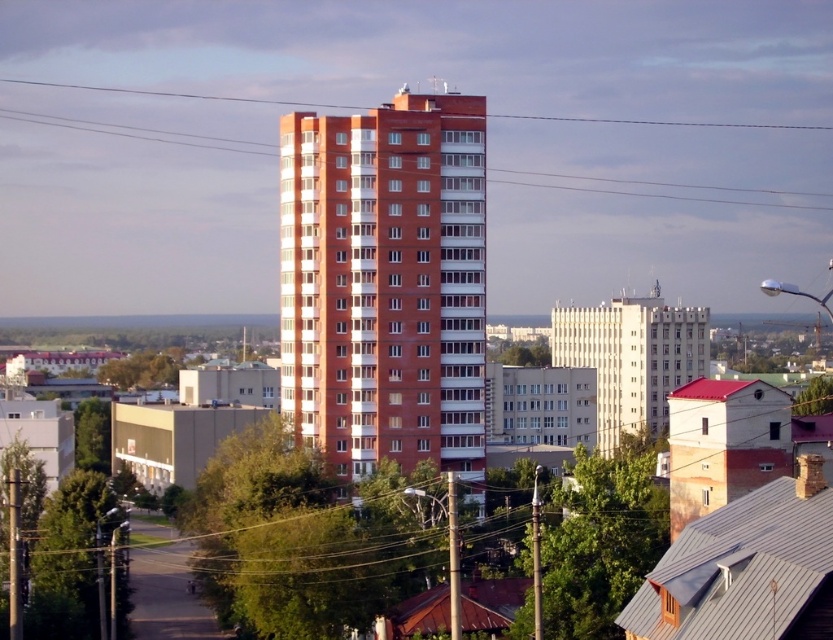
You are an architect analyzing the city layout. You observe the brick building at center and the white smooth building at center. Which building is located higher in the image?

The brick building at center is positioned over the white smooth building at center, so it is higher in the image.

From the picture: You are a city planner reviewing the city layout. You notice two buildings in the center of the image, the brick building at center and the white smooth building at center. Which one has a larger footprint in terms of area?

The brick building at center is bigger than the white smooth building at center, so the brick building at center has a larger footprint in terms of area.

You are standing at the base of the red brick high rise building and looking towards the city. There are two points marked in the image, point 1 at coordinates point [434,289] and point 2 at coordinates point [617,353]. Which point is closer to you?

Point [434,289] is in front of point [617,353], so it is closer to you.